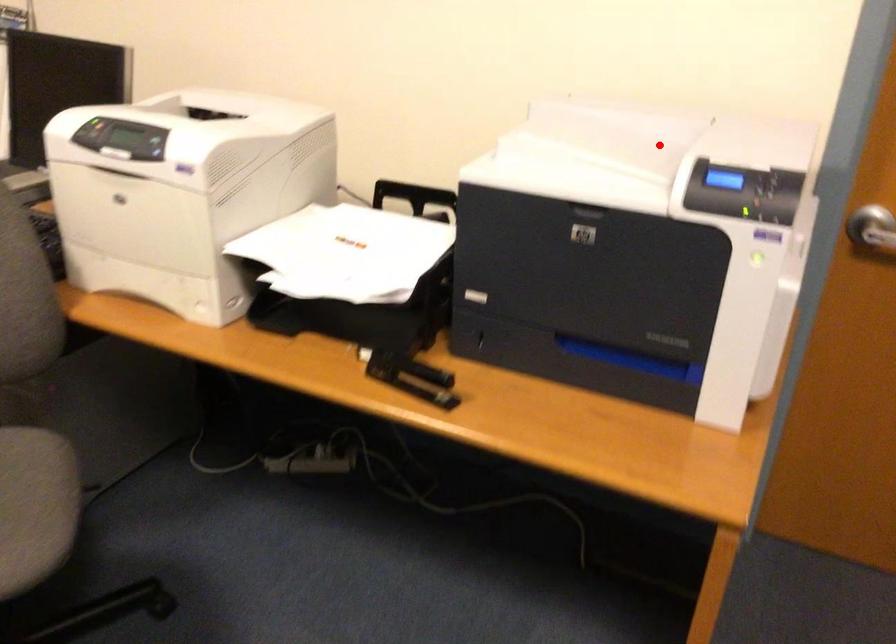
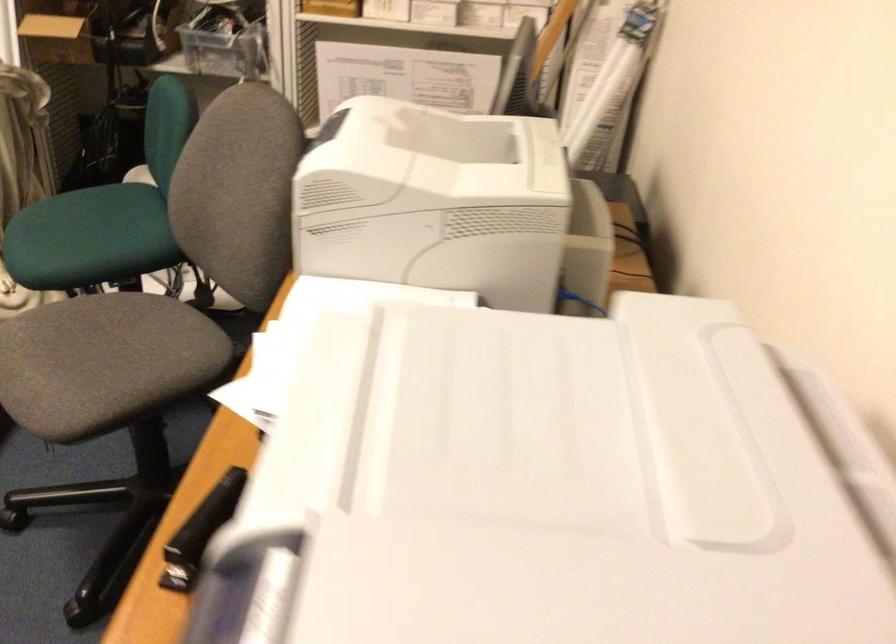
Question: I am providing you with two images of the same scene from different viewpoints. A red point is shown in image1. For the corresponding object point in image2, is it positioned nearer or farther from the camera?

Choices:
 (A) Nearer
 (B) Farther

Answer: (A)